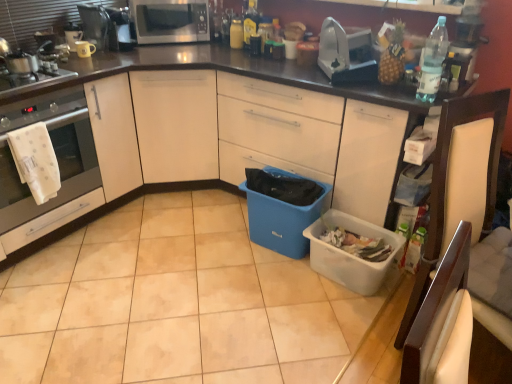
Where is `vacant area that is in front of blue plastic bin at center, which appears as the first storage box when viewed from the left`? This screenshot has height=384, width=512. vacant area that is in front of blue plastic bin at center, which appears as the first storage box when viewed from the left is located at coordinates (275, 284).